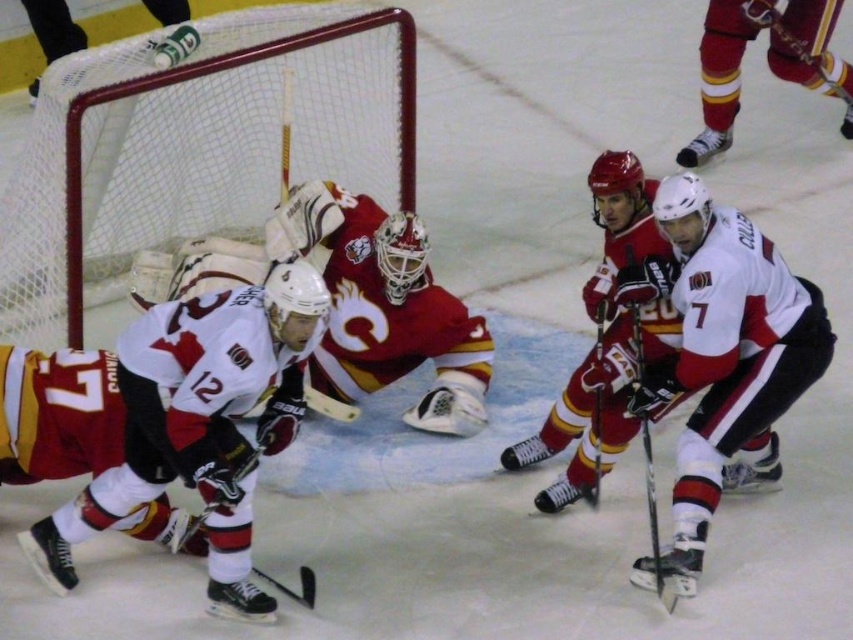
Question: Based on their relative distances, which object is nearer to the black matte hockey stick at center?

Choices:
 (A) shiny black hockey stick at center
 (B) white matte jersey at center
 (C) white matte hockey stick at center
 (D) matte red goalie at center

Answer: (A)

Question: Does white matte jersey at center appear over black matte hockey stick at center?

Choices:
 (A) no
 (B) yes

Answer: (B)

Question: Which of the following is the farthest from the observer?

Choices:
 (A) shiny black hockey stick at center
 (B) maroon jersey at center

Answer: (B)

Question: Does white matte jersey at center come behind black matte hockey stick at center?

Choices:
 (A) no
 (B) yes

Answer: (A)

Question: Considering the relative positions of maroon jersey at center and black matte hockey stick at center in the image provided, where is maroon jersey at center located with respect to black matte hockey stick at center?

Choices:
 (A) right
 (B) left

Answer: (A)

Question: Which object is the closest to the matte red goalie at center?

Choices:
 (A) shiny red jersey at center
 (B) white matte jersey at center

Answer: (A)